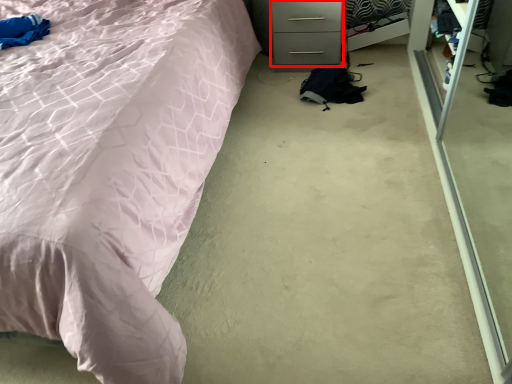
Question: From the image, what is the correct spatial relationship of drawer (annotated by the red box) in relation to bed?

Choices:
 (A) left
 (B) right

Answer: (B)